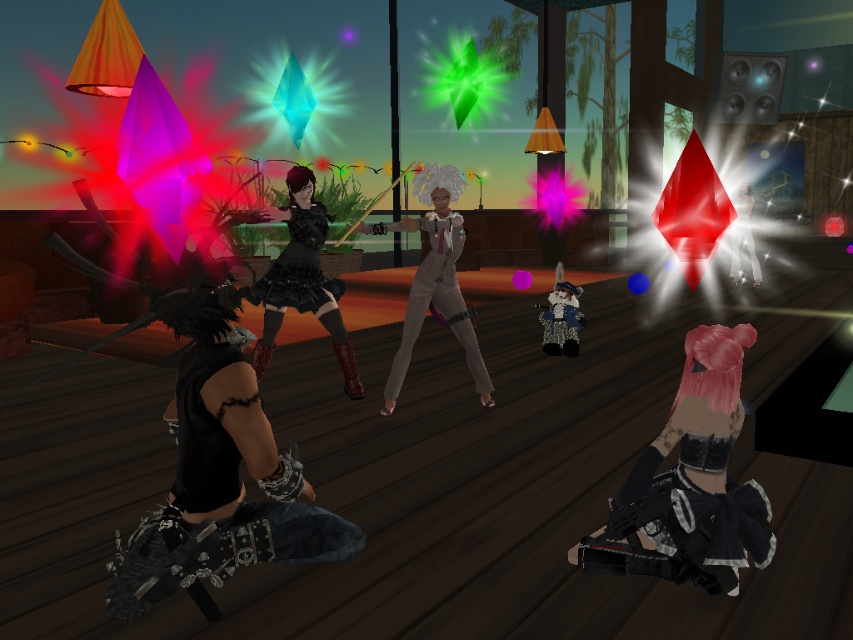
Can you confirm if matte black skirt at center is positioned above white matte pants at center?

Actually, matte black skirt at center is below white matte pants at center.

In the scene shown: Does matte black skirt at center have a greater height compared to white matte pants at center?

Yes.

What do you see at coordinates (302, 280) in the screenshot? I see `matte black skirt at center` at bounding box center [302, 280].

You are a GUI agent. You are given a task and a screenshot of the screen. Output one action in this format:
    pyautogui.click(x=<x>, y=<y>)
    Task: Click on the matte black skirt at center
    The image size is (853, 640).
    Given the screenshot: What is the action you would take?
    pyautogui.click(x=302, y=280)

Is point (706, 392) closer to camera compared to point (273, 308)?

Yes, point (706, 392) is in front of point (273, 308).

Find the location of a particular element. The width and height of the screenshot is (853, 640). black leather jacket at lower right is located at coordinates (689, 483).

Which is behind, point (636, 513) or point (332, 280)?

Positioned behind is point (332, 280).

At what (x,y) coordinates should I click in order to perform the action: click on black leather jacket at lower right. Please return your answer as a coordinate pair (x, y). Looking at the image, I should click on (689, 483).

Is matte black skirt at center shorter than satin beige suit at center?

Yes, matte black skirt at center is shorter than satin beige suit at center.

This screenshot has height=640, width=853. Describe the element at coordinates (302, 280) in the screenshot. I see `matte black skirt at center` at that location.

The height and width of the screenshot is (640, 853). I want to click on matte black skirt at center, so click(x=302, y=280).